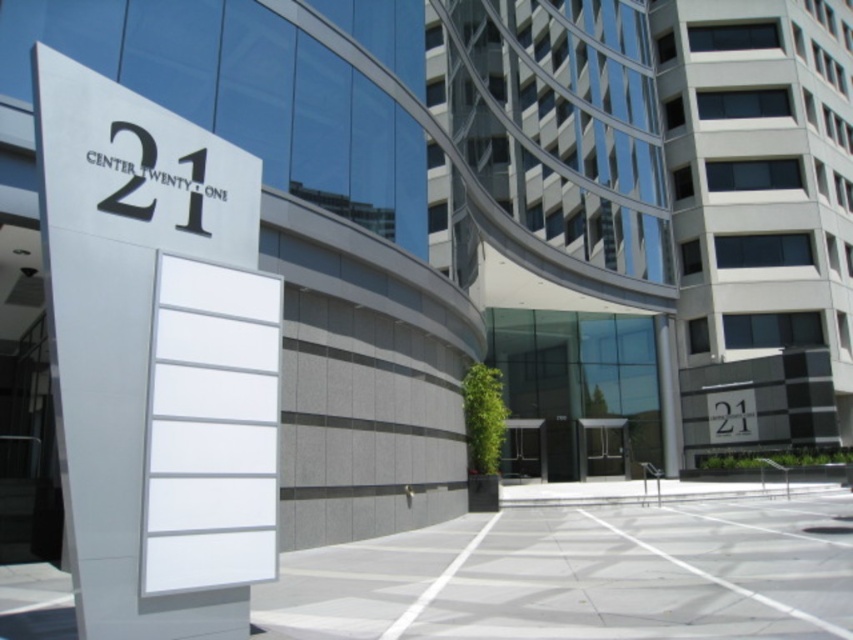
Is transparent glass door at center positioned behind glass door at center?

Yes.

Between point (577, 420) and point (535, 435), which one is positioned behind?

Positioned behind is point (577, 420).

This screenshot has height=640, width=853. Identify the location of transparent glass door at center. pyautogui.click(x=602, y=449).

Is white glossy sign at center below glass door at center?

Incorrect, white glossy sign at center is not positioned below glass door at center.

Is point (77, 172) closer to viewer compared to point (512, 422)?

That is True.

The width and height of the screenshot is (853, 640). I want to click on white glossy sign at center, so click(138, 168).

At what (x,y) coordinates should I click in order to perform the action: click on white glossy sign at center. Please return your answer as a coordinate pair (x, y). This screenshot has height=640, width=853. Looking at the image, I should click on (138, 168).

Between point (76, 186) and point (584, 433), which one is positioned behind?

Point (584, 433)

What are the coordinates of `white glossy sign at center` in the screenshot? It's located at (138, 168).

This screenshot has width=853, height=640. Identify the location of white glossy sign at center. (138, 168).